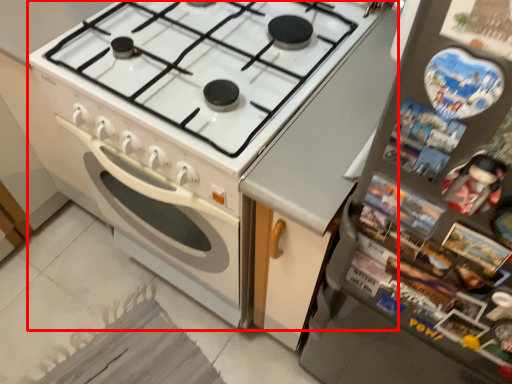
Question: From the image, what is the correct spatial relationship of appliance (annotated by the red box) in relation to refrigerator?

Choices:
 (A) left
 (B) right

Answer: (A)